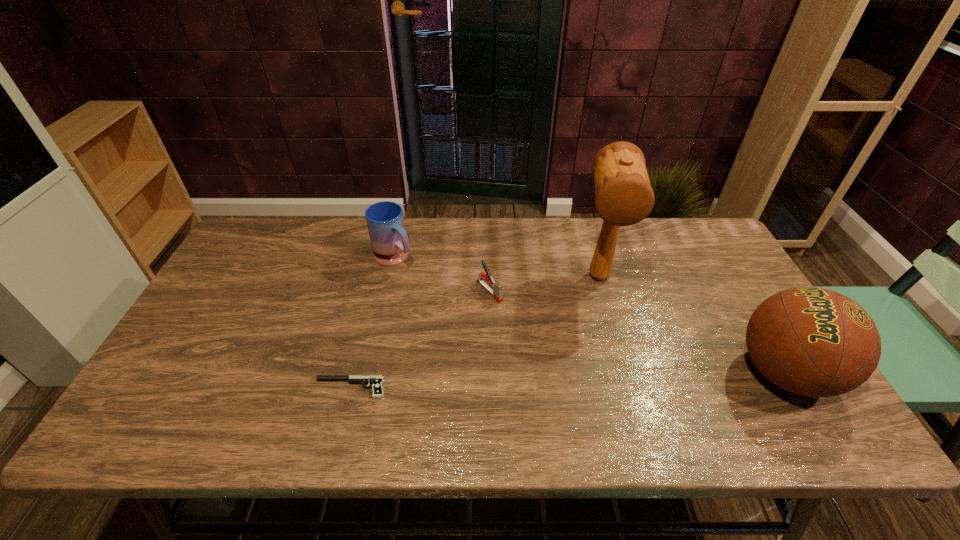
Where is `the shortest object`? the shortest object is located at coordinates (376, 380).

At what (x,y) coordinates should I click in order to perform the action: click on the second tallest object. Please return your answer as a coordinate pair (x, y). This screenshot has width=960, height=540. Looking at the image, I should click on (815, 342).

Locate an element on the screen. This screenshot has width=960, height=540. the rightmost object is located at coordinates (815, 342).

Where is `mallet`? The height and width of the screenshot is (540, 960). mallet is located at coordinates (624, 196).

Identify the location of the tallest object. (624, 196).

What are the coordinates of `the third tallest object` in the screenshot? It's located at (385, 221).

The image size is (960, 540). Find the location of `the fourth tallest object`. the fourth tallest object is located at coordinates tap(497, 289).

Image resolution: width=960 pixels, height=540 pixels. I want to click on the third object from right to left, so click(497, 289).

Find the location of a particular element. This screenshot has height=540, width=960. free location located on the front-facing side of the pistol is located at coordinates (281, 388).

Identify the location of free region located 0.290m on the front-facing side of the pistol. The width and height of the screenshot is (960, 540). (193, 388).